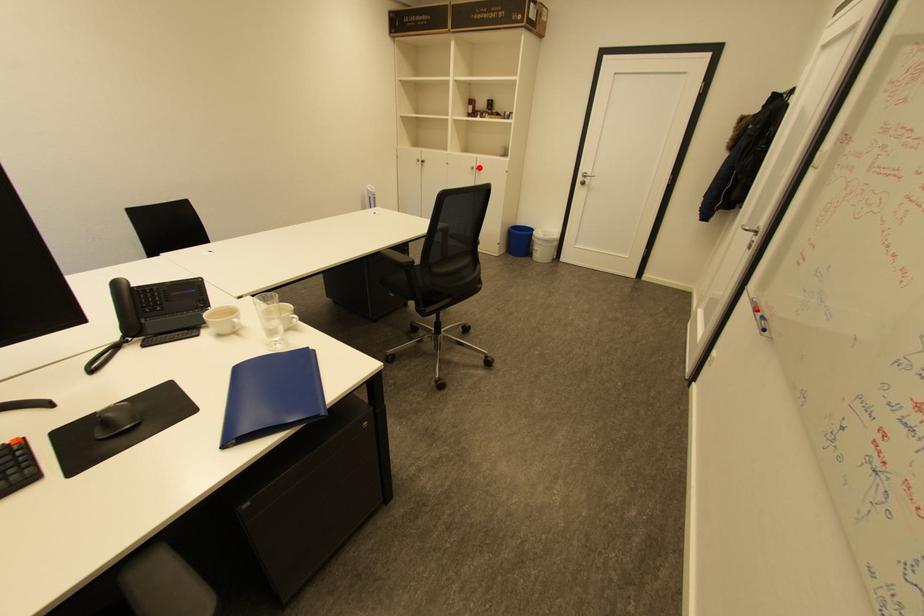
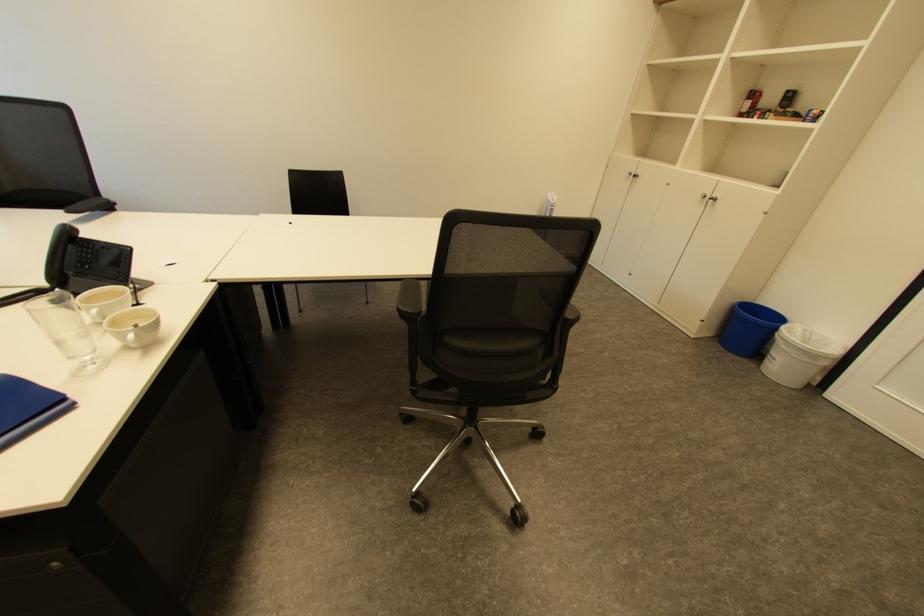
The point at the highlighted location is marked in the first image. Where is the corresponding point in the second image?

(711, 196)